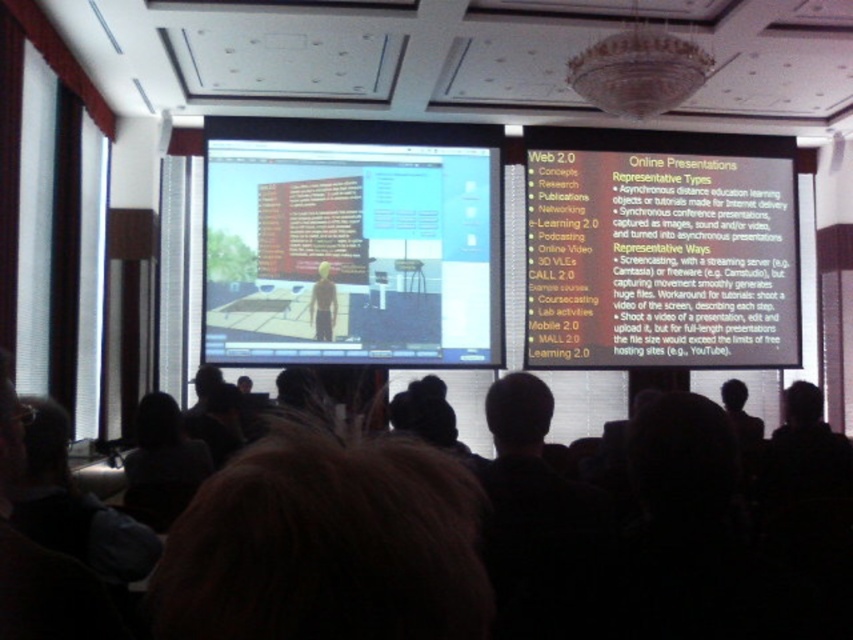
Is point (488, 589) closer to camera compared to point (329, 339)?

Yes, it is.

Is point (689, 477) closer to camera compared to point (312, 301)?

Yes, point (689, 477) is in front of point (312, 301).

This screenshot has width=853, height=640. What are the coordinates of `dark hair at center` in the screenshot? It's located at (328, 545).

Is point (363, 436) positioned behind point (328, 339)?

No, it is in front of (328, 339).

Locate an element on the screen. The image size is (853, 640). brown hair at center is located at coordinates (325, 545).

Does white paper at upper right have a lesser height compared to dark hair at lower left?

No.

Is white paper at upper right to the right of dark hair at lower left from the viewer's perspective?

Correct, you'll find white paper at upper right to the right of dark hair at lower left.

At what (x,y) coordinates should I click in order to perform the action: click on white paper at upper right. Please return your answer as a coordinate pair (x, y). Looking at the image, I should click on (x=660, y=250).

Locate an element on the screen. white paper at upper right is located at coordinates (660, 250).